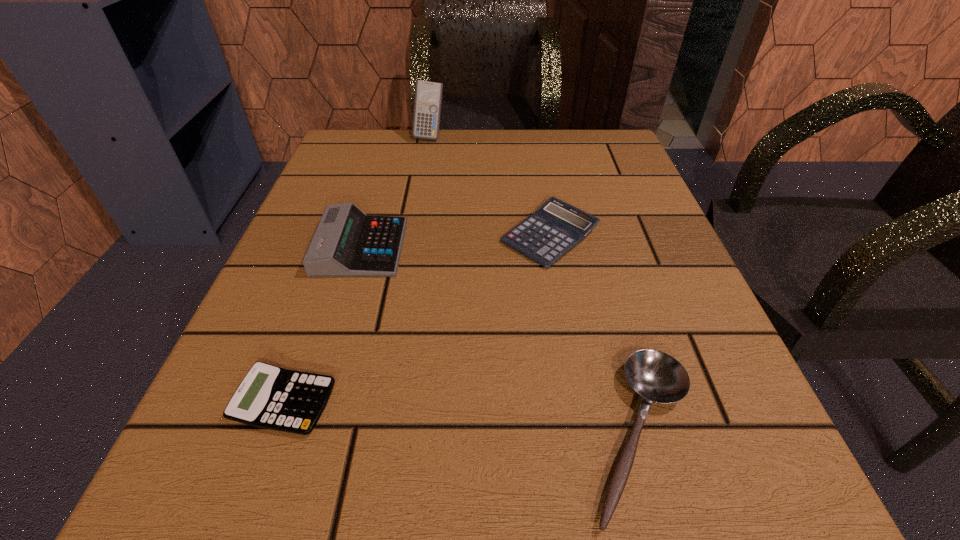
Identify the location of the farthest calculator. The width and height of the screenshot is (960, 540). (428, 96).

Locate an element on the screen. The image size is (960, 540). the tallest calculator is located at coordinates (428, 96).

This screenshot has height=540, width=960. Identify the location of the second tallest object. (347, 243).

Identify the location of the rightmost calculator. (545, 236).

You are a GUI agent. You are given a task and a screenshot of the screen. Output one action in this format:
    pyautogui.click(x=<x>, y=<y>)
    Task: Click on the nearest calculator
    
    Given the screenshot: What is the action you would take?
    [x=270, y=397]

Where is `ladle`? The width and height of the screenshot is (960, 540). ladle is located at coordinates (657, 377).

This screenshot has height=540, width=960. I want to click on vacant area located 0.310m on the front-facing side of the tallest object, so click(413, 231).

The image size is (960, 540). Identify the location of free region located 0.240m on the back of the second tallest calculator. (390, 153).

Image resolution: width=960 pixels, height=540 pixels. Identify the location of vacant space situated on the back of the rightmost calculator. (535, 153).

Identify the location of vacant region located 0.140m on the right of the nearest calculator. The height and width of the screenshot is (540, 960). (451, 402).